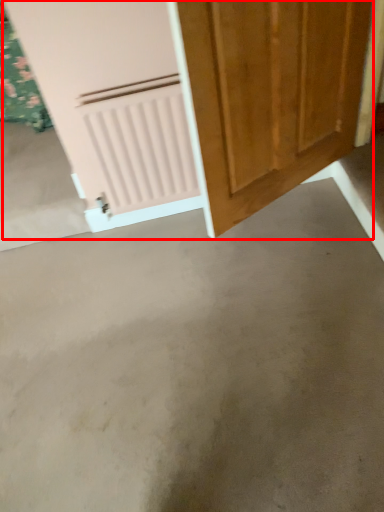
Question: From the image's perspective, where is door (annotated by the red box) located in relation to concrete in the image?

Choices:
 (A) above
 (B) below

Answer: (A)